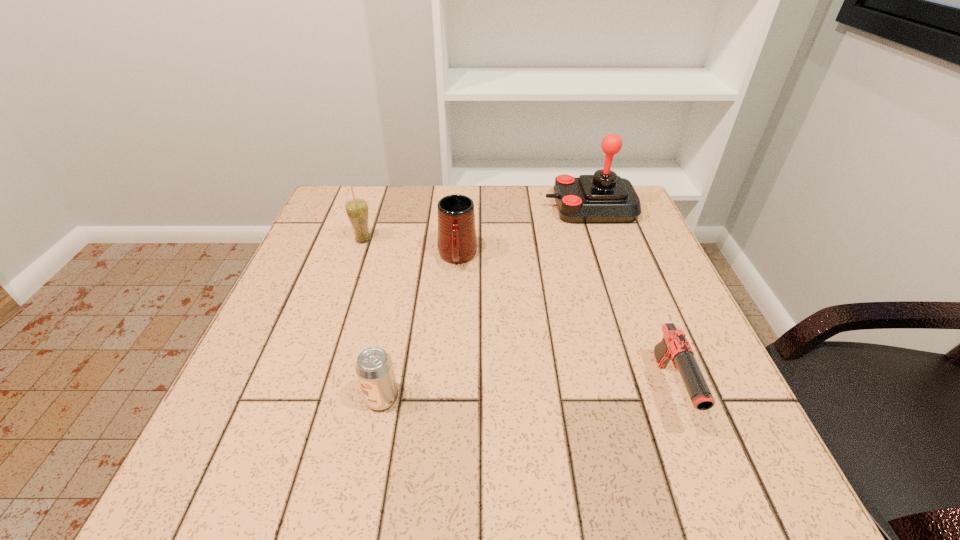
Where is `vacant space located 0.070m on the right of the leftmost object`? The height and width of the screenshot is (540, 960). vacant space located 0.070m on the right of the leftmost object is located at coordinates (401, 240).

Locate an element on the screen. free space located on the side of the third shortest object with the handle is located at coordinates (449, 388).

You are a GUI agent. You are given a task and a screenshot of the screen. Output one action in this format:
    pyautogui.click(x=<x>, y=<y>)
    Task: Click on the vacant point located on the back of the fourth object from right to left
    
    Given the screenshot: What is the action you would take?
    pyautogui.click(x=408, y=264)

Locate an element on the screen. vacant space situated at the aiming end of the gun is located at coordinates (705, 479).

Locate an element on the screen. The height and width of the screenshot is (540, 960). object that is at the far edge is located at coordinates (605, 197).

Find the location of a particular element. object that is at the left edge is located at coordinates (357, 210).

Identify the location of joystick at the right edge. (605, 197).

Find the location of a particular element. The image size is (960, 540). gun located in the right edge section of the desktop is located at coordinates (674, 346).

You are a GUI agent. You are given a task and a screenshot of the screen. Output one action in this format:
    pyautogui.click(x=<x>, y=<y>)
    Task: Click on the object that is positioned at the far right corner
    
    Given the screenshot: What is the action you would take?
    pyautogui.click(x=605, y=197)

This screenshot has height=540, width=960. In the image, there is a desktop. In order to click on vacant region at the far edge in this screenshot , I will do `click(432, 186)`.